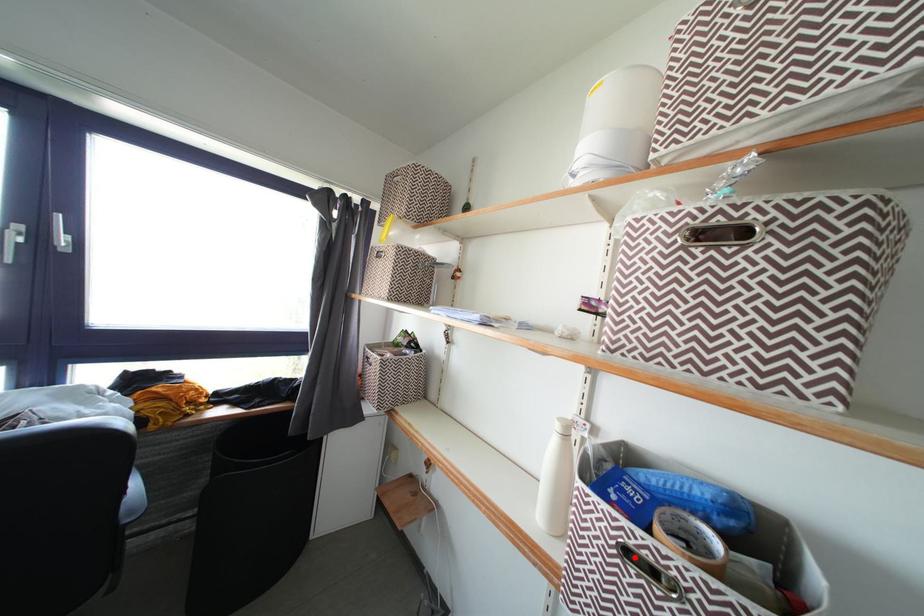
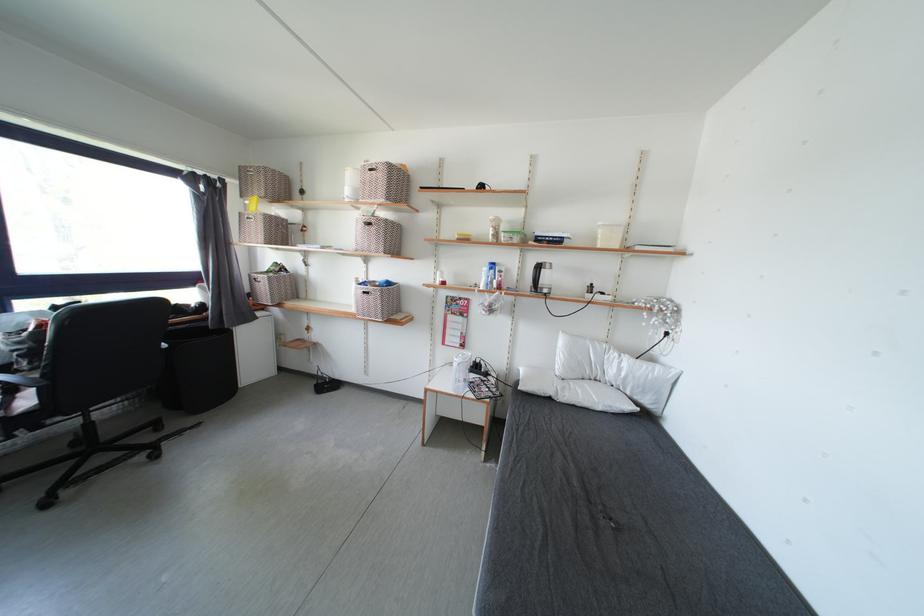
Question: I am providing you with two images of the same scene from different viewpoints. Given a red point in image1, look at the same physical point in image2. Is it:

Choices:
 (A) Closer to the viewpoint
 (B) Farther from the viewpoint

Answer: (A)